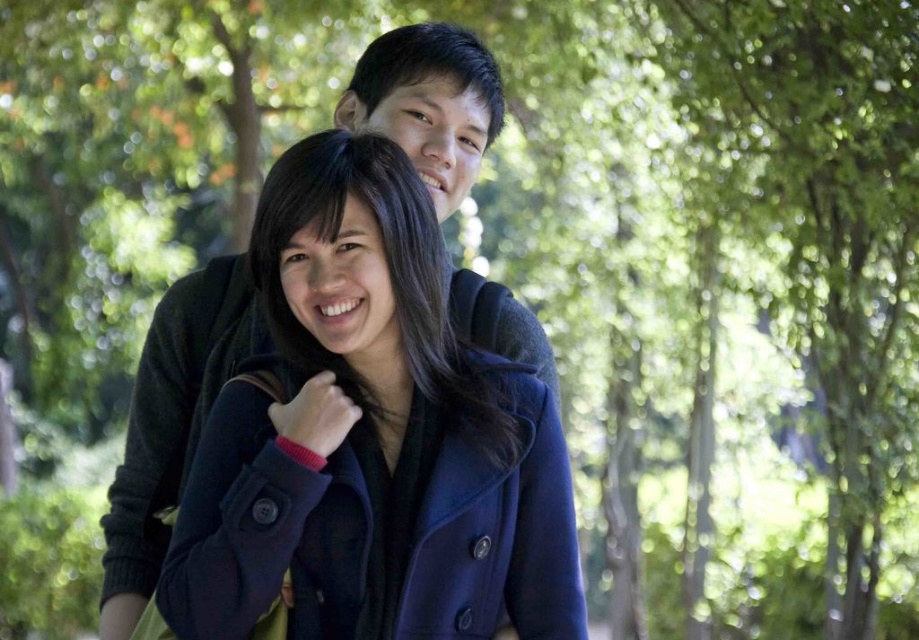
Question: Considering the relative positions of navy wool coat at center and green leafy tree at upper center in the image provided, where is navy wool coat at center located with respect to green leafy tree at upper center?

Choices:
 (A) above
 (B) below

Answer: (B)

Question: Can you confirm if navy wool coat at center is positioned below green leafy tree at upper center?

Choices:
 (A) yes
 (B) no

Answer: (A)

Question: Which point is farther to the camera?

Choices:
 (A) (725, 124)
 (B) (556, 611)

Answer: (A)

Question: Which point is closer to the camera?

Choices:
 (A) (883, 332)
 (B) (407, 483)

Answer: (B)

Question: Considering the relative positions of navy wool coat at center and green leafy tree at upper center in the image provided, where is navy wool coat at center located with respect to green leafy tree at upper center?

Choices:
 (A) right
 (B) left

Answer: (B)